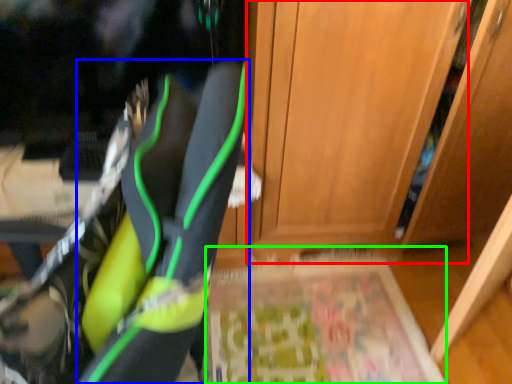
Question: Which object is the closest to the door (highlighted by a red box)? Choose among these: footwear (highlighted by a blue box) or yoga mat (highlighted by a green box).

Choices:
 (A) footwear
 (B) yoga mat

Answer: (B)